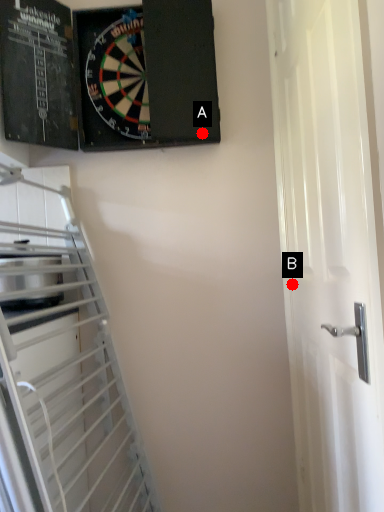
Question: Two points are circled on the image, labeled by A and B beside each circle. Which point is closer to the camera?

Choices:
 (A) A is closer
 (B) B is closer

Answer: (A)